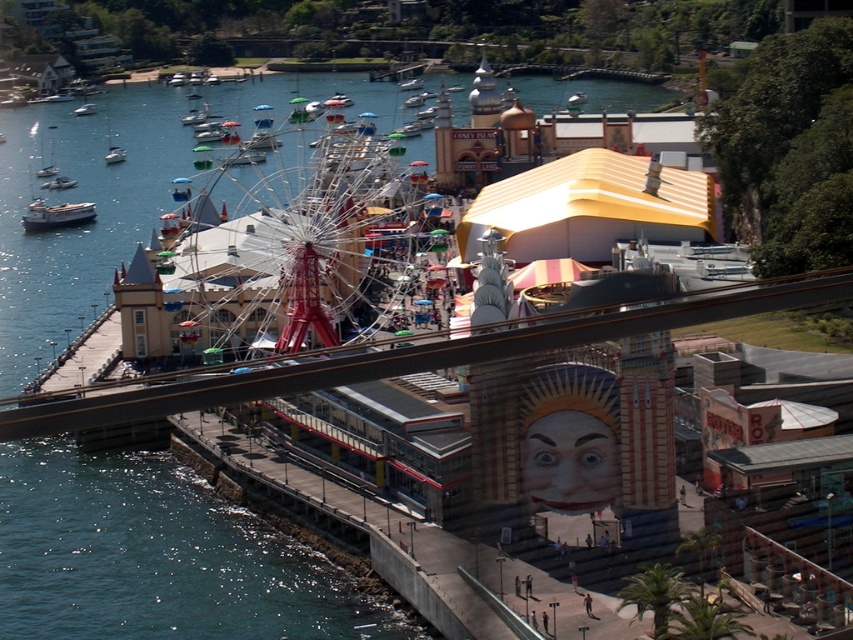
Based on the photo, can you confirm if white metallic ferris wheel at center is thinner than white matte boat at left?

No.

Can you confirm if white metallic ferris wheel at center is taller than white matte boat at left?

Correct, white metallic ferris wheel at center is much taller as white matte boat at left.

Is point (334, 227) less distant than point (50, 220)?

Yes.

Find the location of a particular element. This screenshot has height=640, width=853. white metallic ferris wheel at center is located at coordinates (289, 260).

Who is taller, white metallic ferris wheel at center or white plastic boat at lower left?

Result: Standing taller between the two is white metallic ferris wheel at center.

Does white metallic ferris wheel at center have a lesser height compared to white plastic boat at lower left?

No, white metallic ferris wheel at center is not shorter than white plastic boat at lower left.

You are a GUI agent. You are given a task and a screenshot of the screen. Output one action in this format:
    pyautogui.click(x=<x>, y=<y>)
    Task: Click on the white metallic ferris wheel at center
    This screenshot has width=853, height=640.
    Given the screenshot: What is the action you would take?
    pyautogui.click(x=289, y=260)

Is white matte boat at left thinner than white plastic boat at lower left?

No, white matte boat at left is not thinner than white plastic boat at lower left.

Identify the location of white matte boat at left. This screenshot has width=853, height=640. (56, 214).

Does point (24, 218) lie in front of point (74, 182)?

Yes.

Image resolution: width=853 pixels, height=640 pixels. I want to click on white matte boat at left, so coord(56,214).